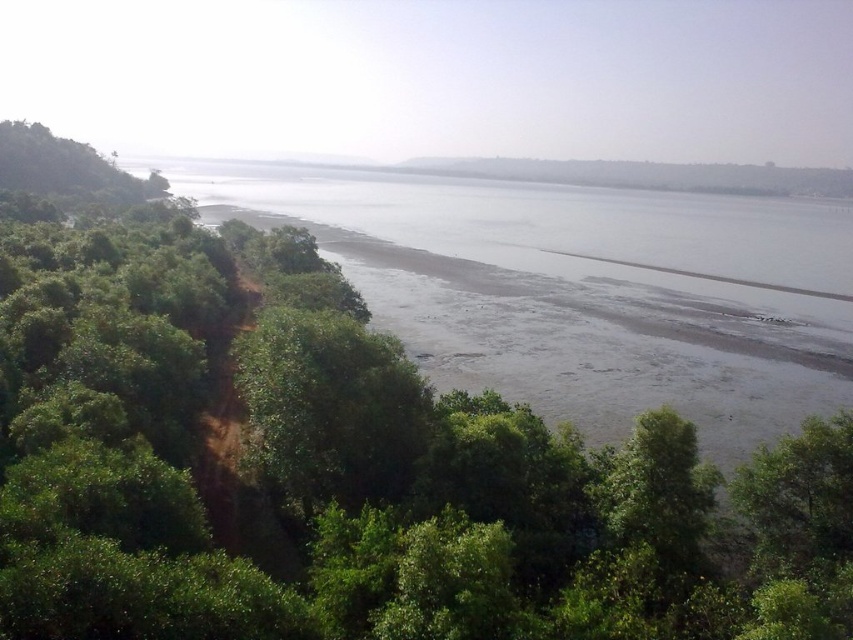
Question: Among these points, which one is farthest from the camera?

Choices:
 (A) (595, 170)
 (B) (436, 348)

Answer: (A)

Question: Observing the image, what is the correct spatial positioning of greenish-gray mudflat at lower center in reference to green grassy hillside at center?

Choices:
 (A) right
 (B) left

Answer: (B)

Question: Does greenish-gray mudflat at lower center have a larger size compared to green grassy hillside at center?

Choices:
 (A) yes
 (B) no

Answer: (A)

Question: Can you confirm if greenish-gray mudflat at lower center is smaller than green grassy hillside at center?

Choices:
 (A) yes
 (B) no

Answer: (B)

Question: Which of the following is the closest to the observer?

Choices:
 (A) greenish-gray mudflat at lower center
 (B) green grassy hillside at center

Answer: (A)

Question: Which of the following is the farthest from the observer?

Choices:
 (A) greenish-gray mudflat at lower center
 (B) green grassy hillside at center

Answer: (B)